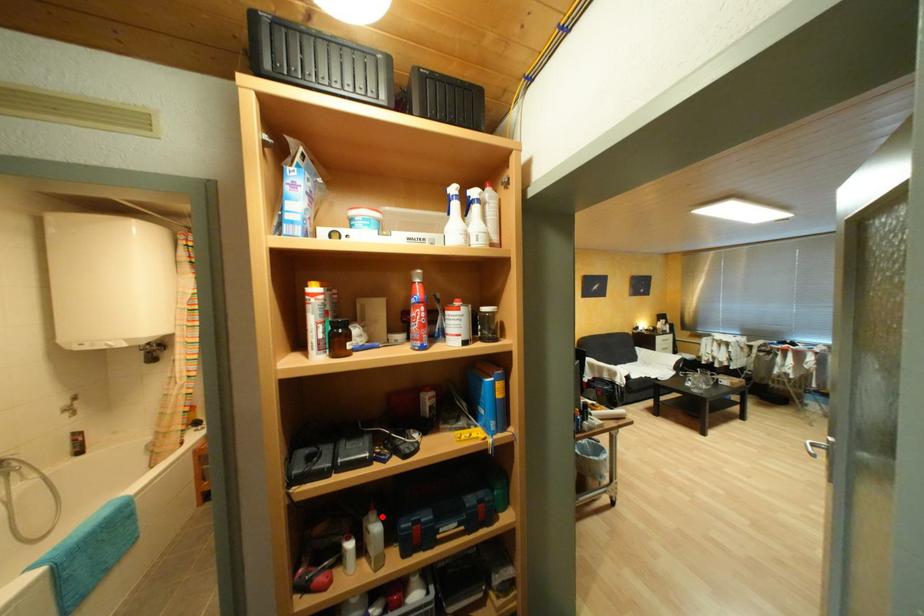
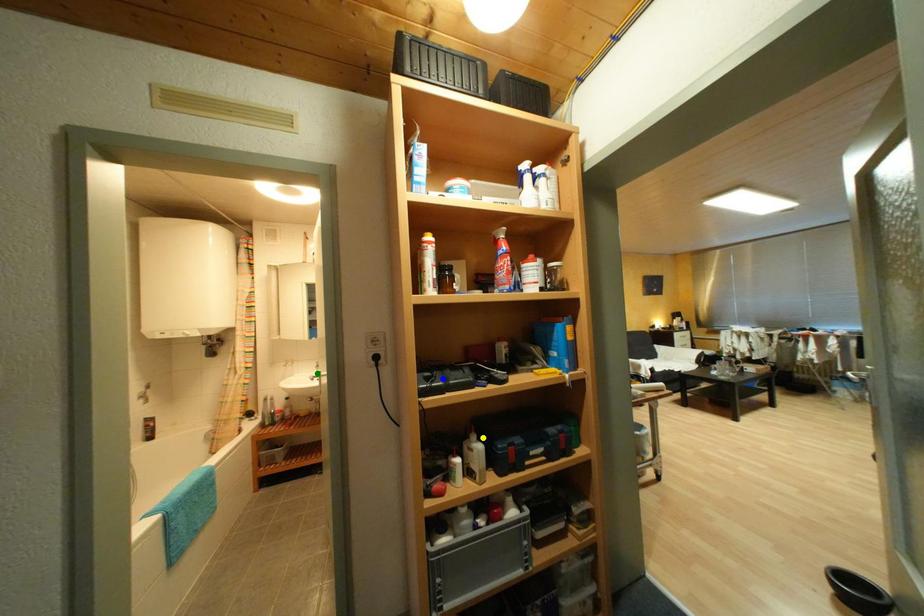
Question: I am providing you with two images of the same scene from different viewpoints. A red point is marked on the first image. You are given multiple points on the second image. Can you choose the point in image 2 that corresponds to the point in image 1?

Choices:
 (A) yellow point
 (B) blue point
 (C) green point

Answer: (A)